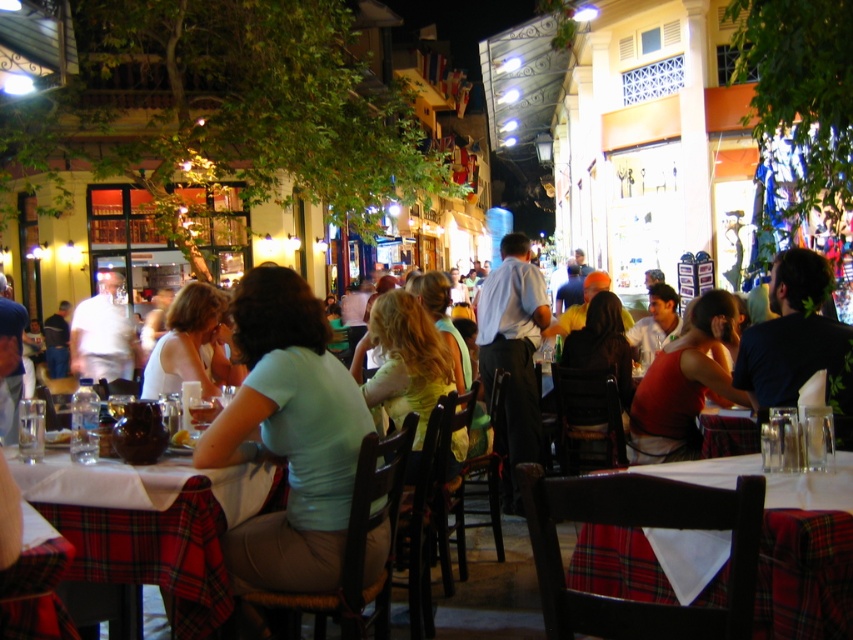
Who is lower down, plaid fabric tablecloth at center or dark blue shirt at right?

plaid fabric tablecloth at center

Between plaid fabric tablecloth at center and dark blue shirt at right, which one has more height?

→ Standing taller between the two is dark blue shirt at right.

Find the location of a particular element. plaid fabric tablecloth at center is located at coordinates coord(155,552).

At what (x,y) coordinates should I click in order to perform the action: click on plaid fabric tablecloth at center. Please return your answer as a coordinate pair (x, y). Looking at the image, I should click on (155, 552).

Is point (165, 509) closer to viewer compared to point (664, 424)?

Yes, it is.

Does plaid fabric tablecloth at center appear on the left side of matte red dress at center?

Indeed, plaid fabric tablecloth at center is positioned on the left side of matte red dress at center.

Is point (146, 552) farther from viewer compared to point (711, 317)?

No, it is not.

Locate an element on the screen. The width and height of the screenshot is (853, 640). plaid fabric tablecloth at center is located at coordinates (155, 552).

The width and height of the screenshot is (853, 640). I want to click on light blue fabric shirt at center, so click(288, 436).

Who is positioned more to the right, light blue fabric shirt at center or white cloth at center?

white cloth at center

This screenshot has width=853, height=640. In order to click on light blue fabric shirt at center in this screenshot , I will do `click(288, 436)`.